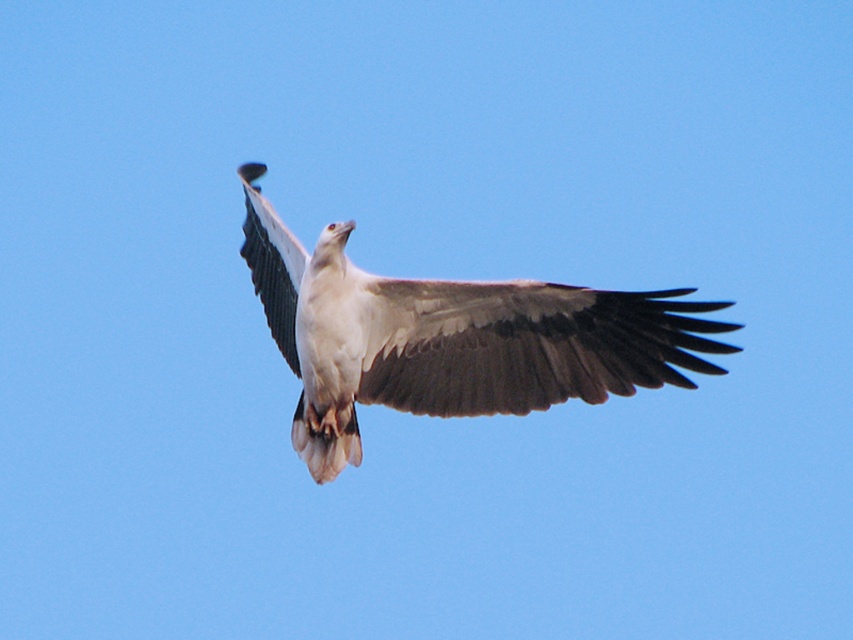
Question: Can you confirm if white feathered eagle at center is bigger than white feathered wing at center?

Choices:
 (A) yes
 (B) no

Answer: (B)

Question: Which point is closer to the camera?

Choices:
 (A) brown feathered wing at center
 (B) white feathered eagle at center
 (C) white feathered wing at center

Answer: (A)

Question: Based on their relative distances, which object is farther from the brown feathered wing at center?

Choices:
 (A) white feathered eagle at center
 (B) white feathered wing at center

Answer: (A)

Question: Does brown feathered wing at center appear under white feathered wing at center?

Choices:
 (A) yes
 (B) no

Answer: (A)

Question: Does white feathered eagle at center appear on the right side of brown feathered wing at center?

Choices:
 (A) no
 (B) yes

Answer: (A)

Question: Estimate the real-world distances between objects in this image. Which object is closer to the white feathered wing at center?

Choices:
 (A) brown feathered wing at center
 (B) white feathered eagle at center

Answer: (A)